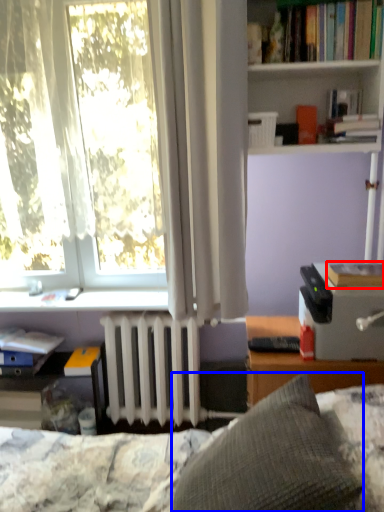
Question: Which of the following is the closest to the observer, book (highlighted by a red box) or pillow (highlighted by a blue box)?

Choices:
 (A) book
 (B) pillow

Answer: (B)